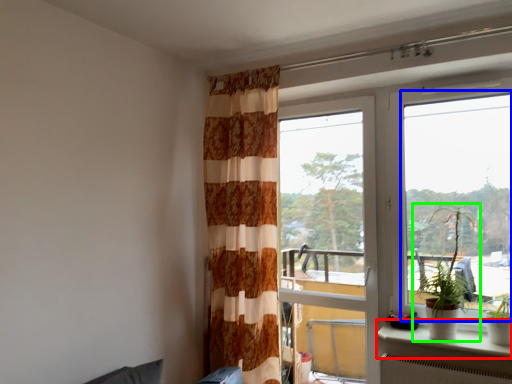
Question: Considering the real-world distances, which object is closest to window sill (highlighted by a red box)? window (highlighted by a blue box) or houseplant (highlighted by a green box).

Choices:
 (A) window
 (B) houseplant

Answer: (B)